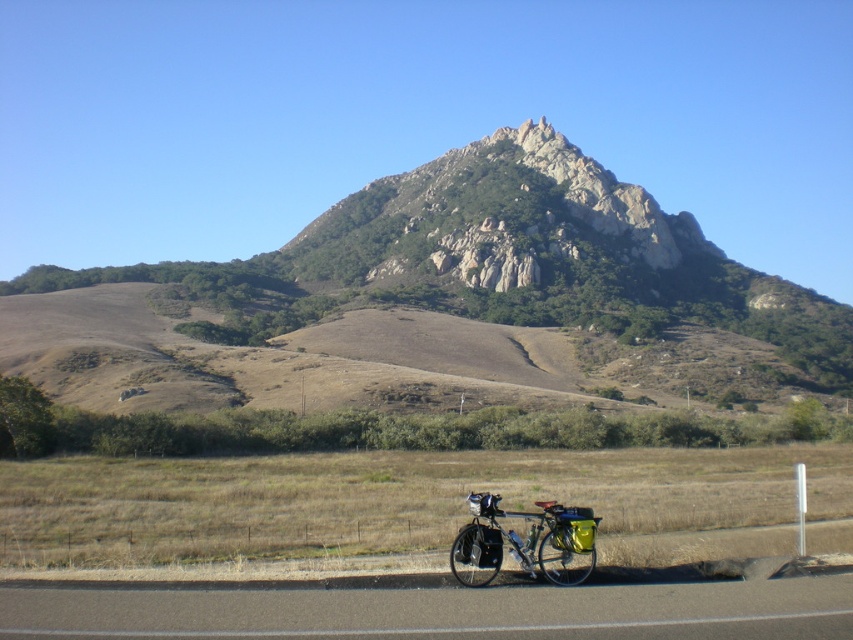
Is green grassy field at lower center wider than rugged stone mountain at center?

In fact, green grassy field at lower center might be narrower than rugged stone mountain at center.

Where is `green grassy field at lower center`? green grassy field at lower center is located at coordinates (395, 484).

Does rocky at center appear under shiny metallic bicycle at lower center?

Incorrect, rocky at center is not positioned below shiny metallic bicycle at lower center.

Looking at this image, can you confirm if rocky at center is positioned to the left of shiny metallic bicycle at lower center?

Yes, rocky at center is to the left of shiny metallic bicycle at lower center.

Is point (647, 312) closer to camera compared to point (463, 580)?

No, (647, 312) is further to viewer.

This screenshot has height=640, width=853. What are the coordinates of `rocky at center` in the screenshot? It's located at (496, 260).

Is green grassy field at lower center shorter than shiny metallic bicycle at lower center?

No.

Between green grassy field at lower center and shiny metallic bicycle at lower center, which one has more height?

green grassy field at lower center is taller.

Locate an element on the screen. Image resolution: width=853 pixels, height=640 pixels. green grassy field at lower center is located at coordinates (395, 484).

You are a GUI agent. You are given a task and a screenshot of the screen. Output one action in this format:
    pyautogui.click(x=<x>, y=<y>)
    Task: Click on the green grassy field at lower center
    
    Given the screenshot: What is the action you would take?
    (x=395, y=484)